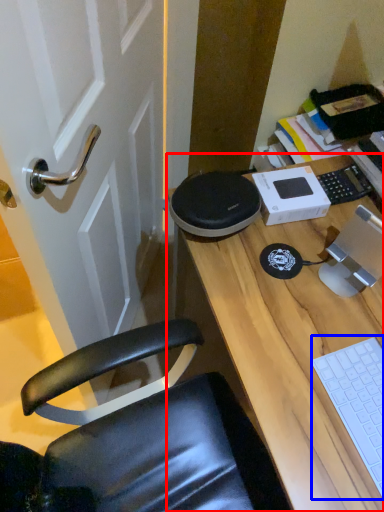
Question: Which object is further to the camera taking this photo, desk (highlighted by a red box) or laptop keyboard (highlighted by a blue box)?

Choices:
 (A) desk
 (B) laptop keyboard

Answer: (B)